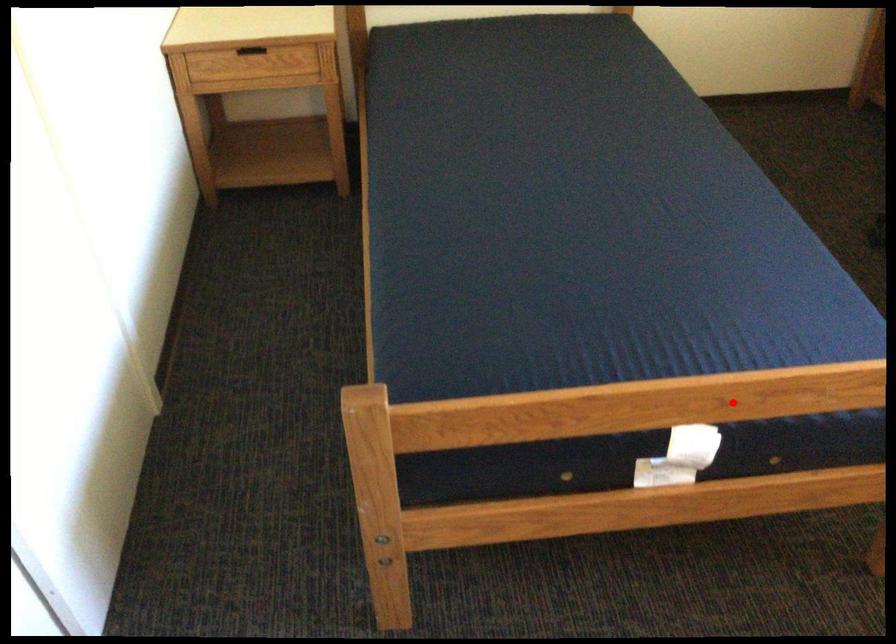
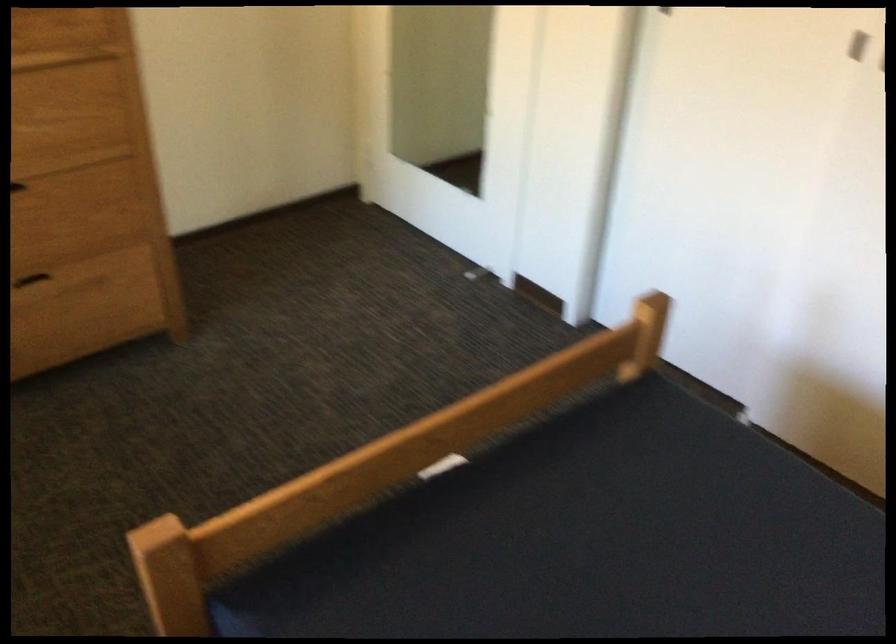
Where in the second image is the point corresponding to the highlighted location from the first image?

(427, 440)